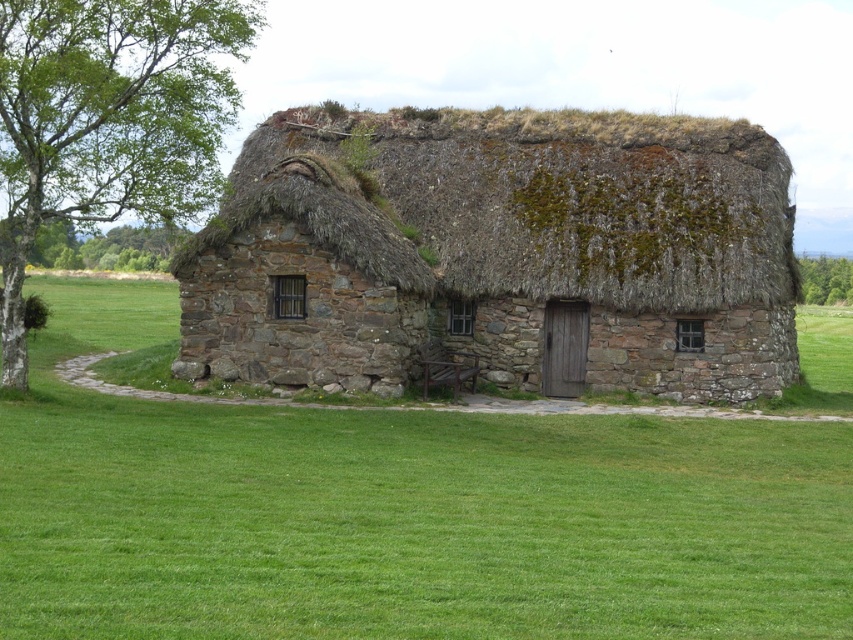
You are standing in front of the stone cottage and notice two green leafy trees in the background. Which tree, the green leafy tree at upper left or the green leafy tree at upper right, has a larger width?

The green leafy tree at upper left might be wider than the green leafy tree at upper right according to the description.

You are standing in front of the stone cottage and notice two green leafy trees. Which tree, the green leafy tree at left or the green leafy tree at upper right, appears to be closer to the cottage?

Result: The green leafy tree at left appears closer to the cottage because it is smaller in size compared to the green leafy tree at upper right. In perspective, smaller objects can appear farther away, but since the question is about proximity to the cottage from your vantage point, the smaller tree might actually be closer. However, based on the description stating the tree at left is smaller, it might be farther. Wait, there might be confusion here. Let me clarify. The description says the tree at left is SMALL,